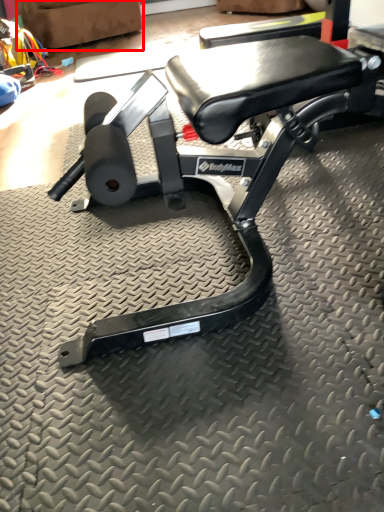
Question: From the image's perspective, considering the relative positions of swivel chair (annotated by the red box) and bench in the image provided, where is swivel chair (annotated by the red box) located with respect to the staircase?

Choices:
 (A) above
 (B) below

Answer: (A)